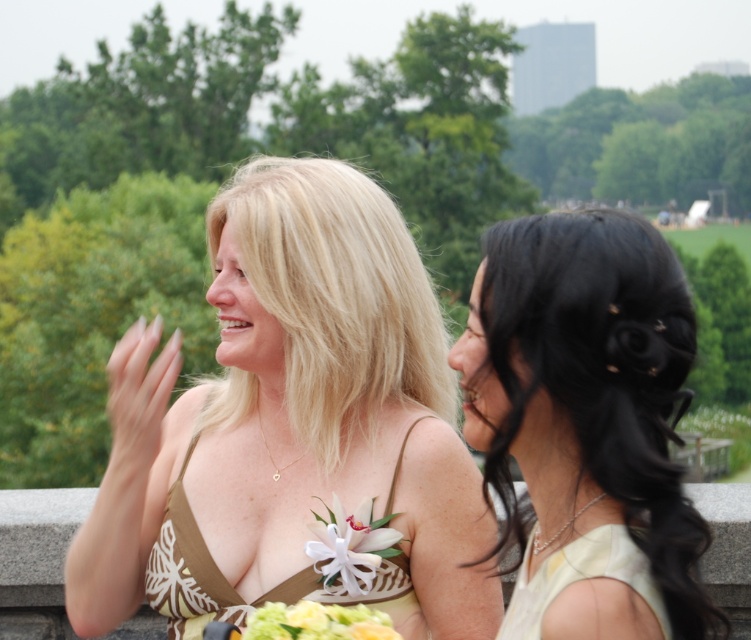
Which is more to the left, white fabric flower at center or floral bouquet at center?

floral bouquet at center is more to the left.

Between white fabric flower at center and floral bouquet at center, which one has more height?

With more height is white fabric flower at center.

Is point (314, 522) farther from viewer compared to point (354, 612)?

Yes, it is.

The width and height of the screenshot is (751, 640). I want to click on white fabric flower at center, so click(350, 547).

Is point (590, 589) more distant than point (222, 589)?

That is False.

Locate an element on the screen. black shiny hair at right is located at coordinates (587, 392).

Does black shiny hair at right have a lesser width compared to floral bouquet at center?

No, black shiny hair at right is not thinner than floral bouquet at center.

What are the coordinates of `black shiny hair at right` in the screenshot? It's located at (587, 392).

The height and width of the screenshot is (640, 751). Find the location of `black shiny hair at right`. black shiny hair at right is located at coordinates (587, 392).